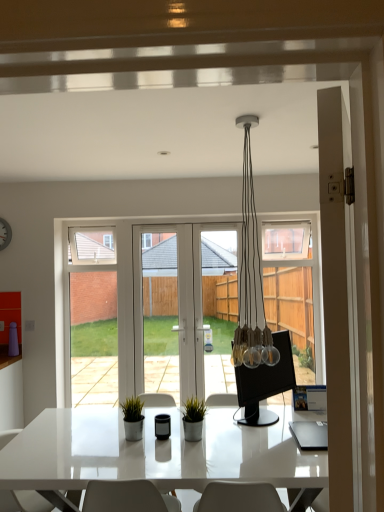
Identify the location of vacant space underneath black glossy monitor at center (from a real-world perspective). (252, 416).